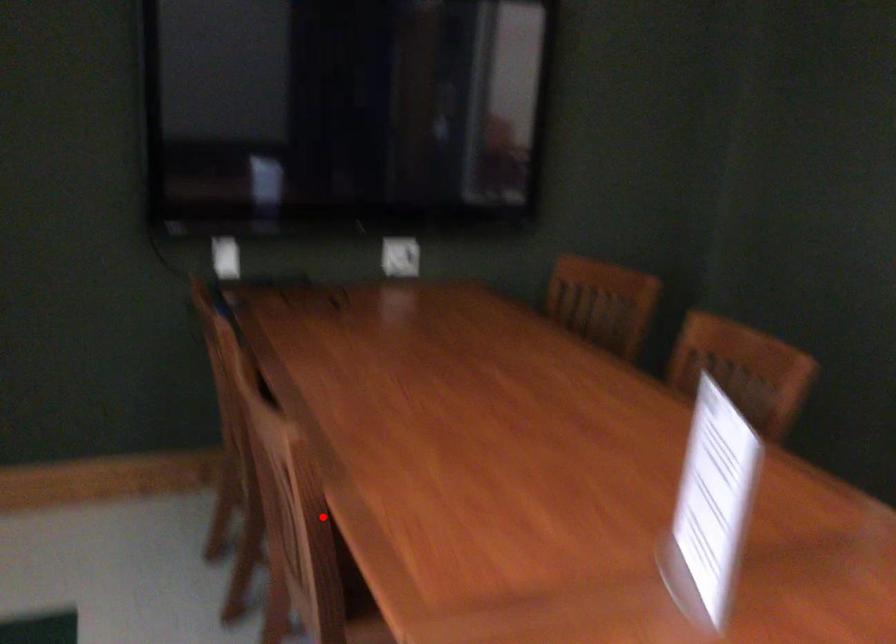
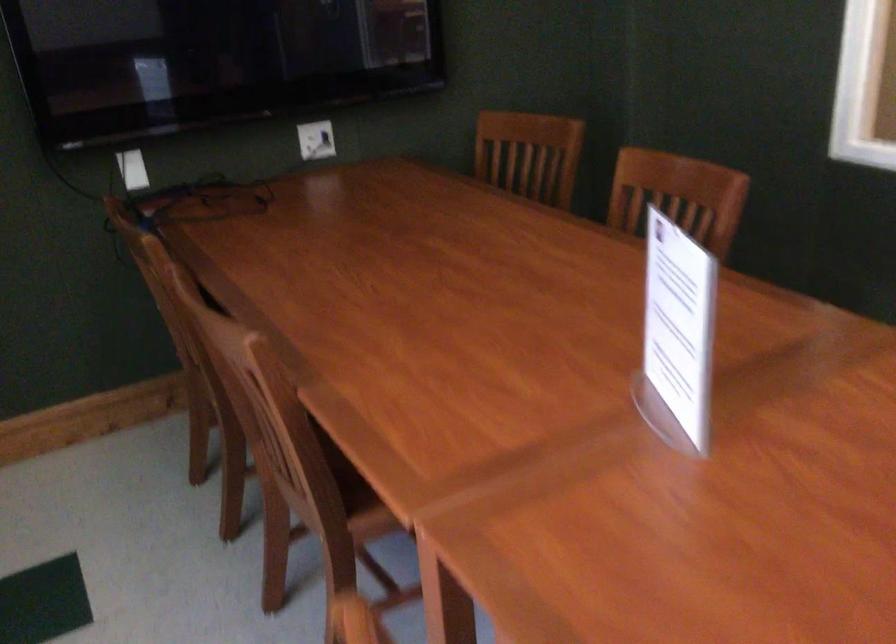
Where in the second image is the point corresponding to the highlighted location from the first image?

(299, 413)